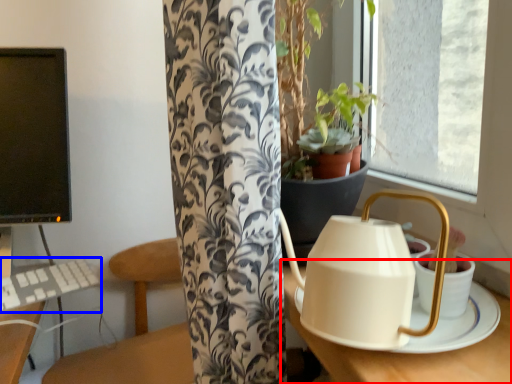
Question: Which object is closer to the camera taking this photo, round table (highlighted by a red box) or keyboard (highlighted by a blue box)?

Choices:
 (A) round table
 (B) keyboard

Answer: (A)